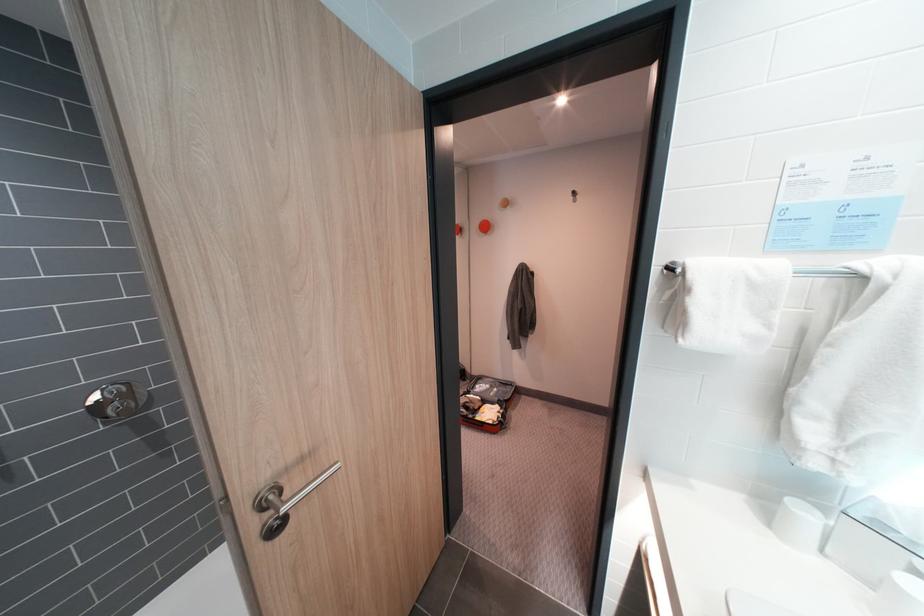
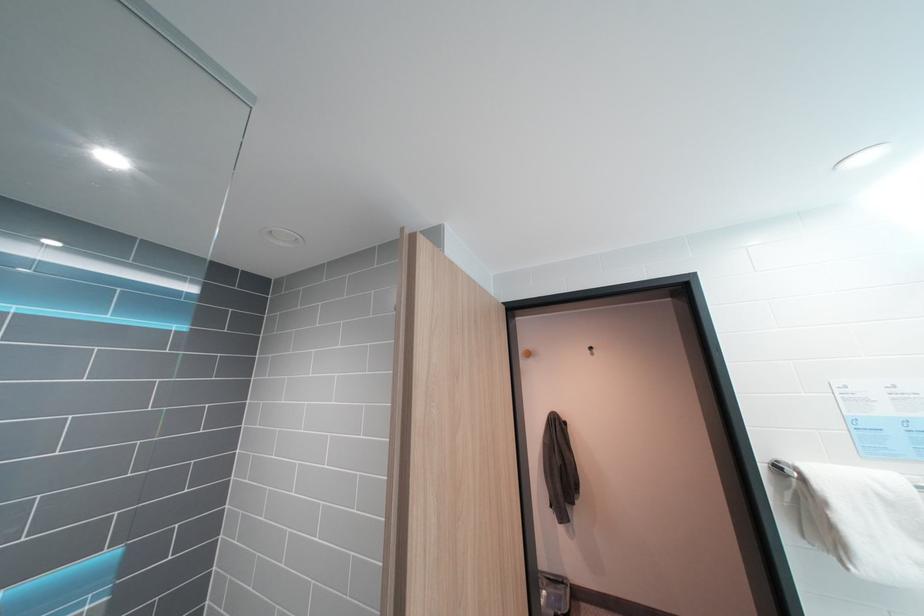
Question: The first image is from the beginning of the video and the second image is from the end. How did the camera likely rotate when shooting the video?

Choices:
 (A) Left
 (B) Right
 (C) Up
 (D) Down

Answer: (C)